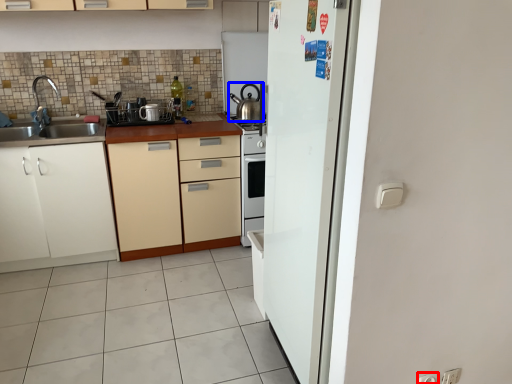
Question: Which of the following is the closest to the observer, electric outlet (highlighted by a red box) or kitchen appliance (highlighted by a blue box)?

Choices:
 (A) electric outlet
 (B) kitchen appliance

Answer: (A)